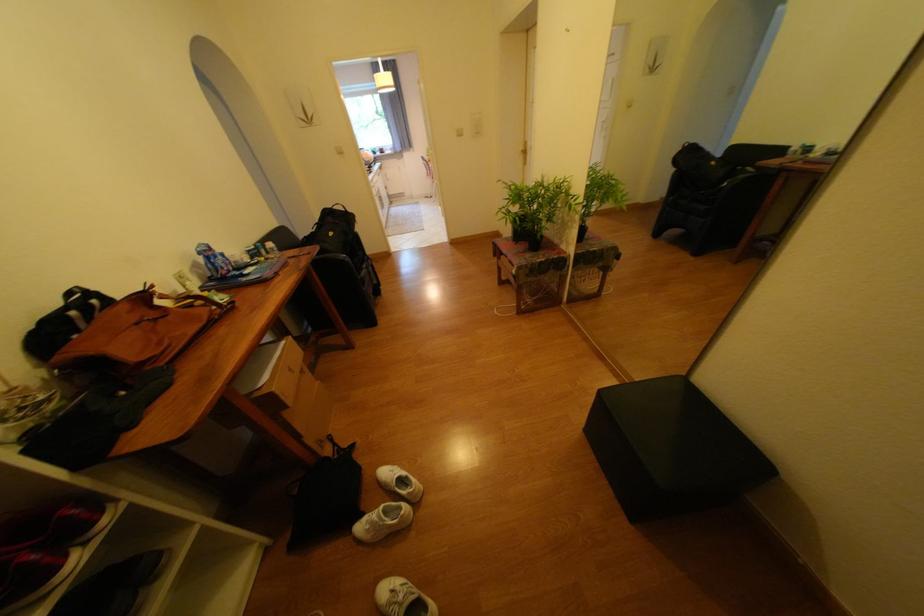
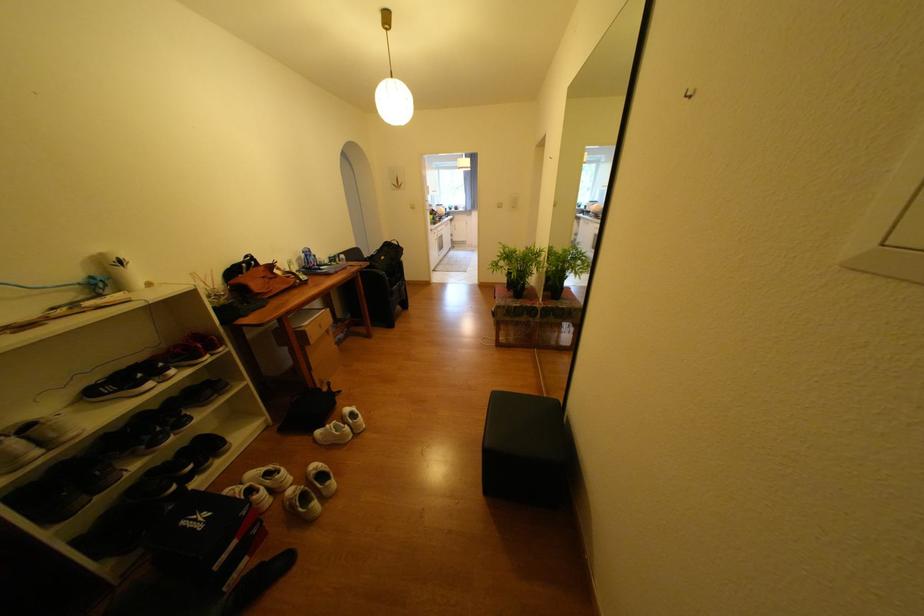
The point at (407,148) is marked in the first image. Where is the corresponding point in the second image?

(479, 208)